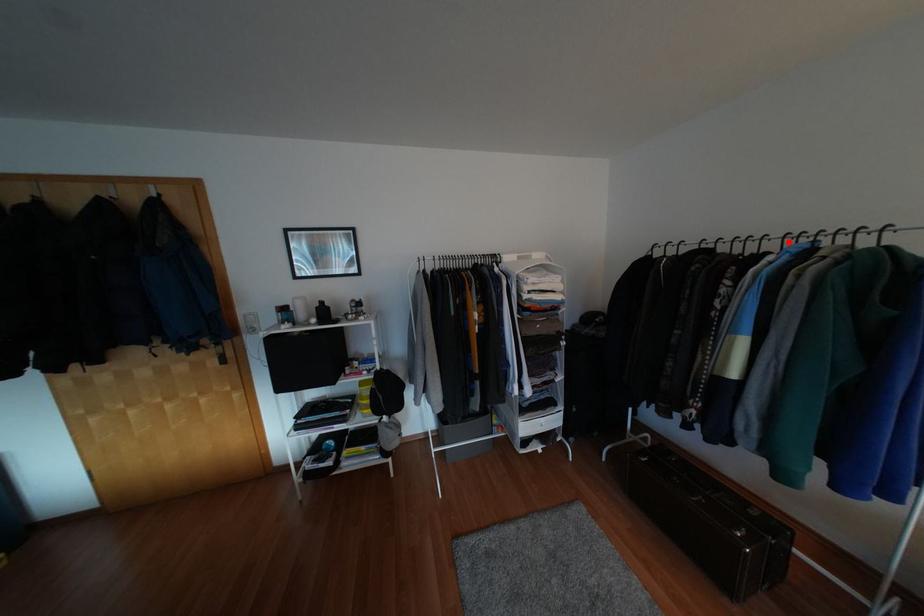
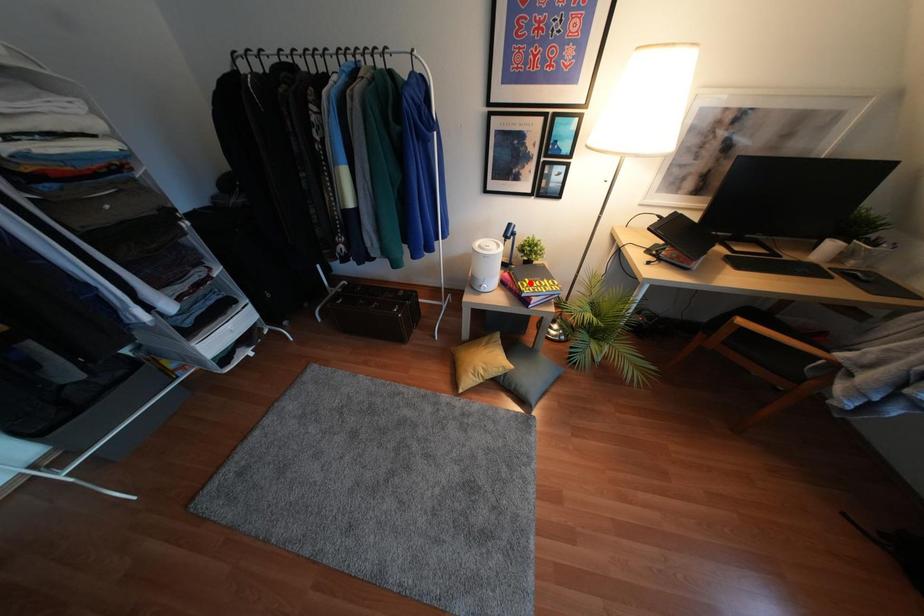
I am providing you with two images of the same scene from different viewpoints. A red point is marked on the first image and another point is marked on the second image. Do the highlighted points in image1 and image2 indicate the same real-world spot?

No